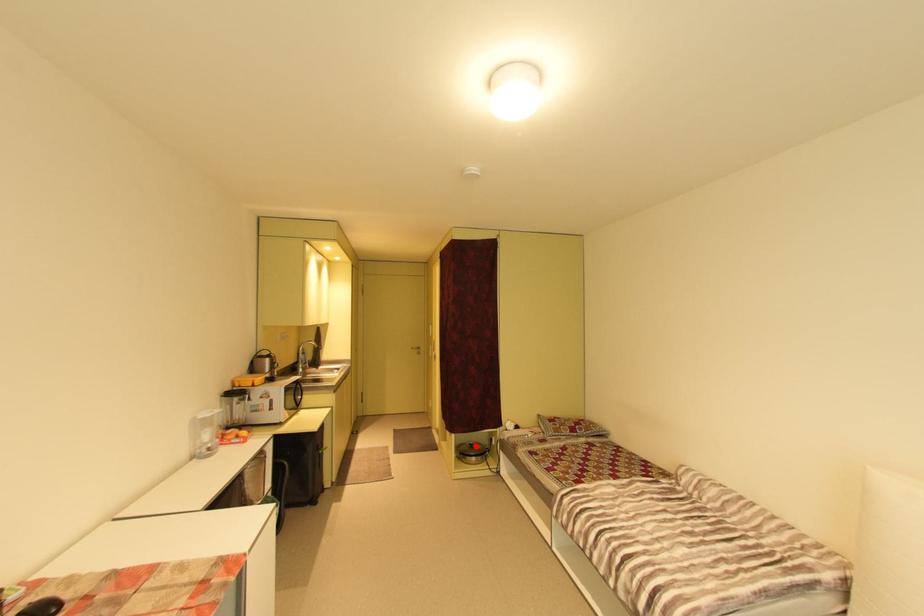
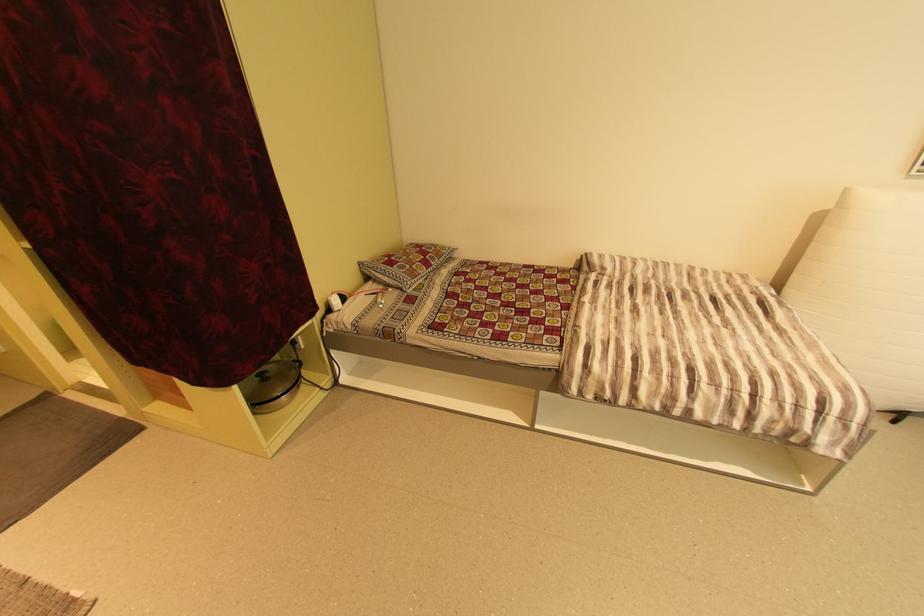
Question: I am providing you with two images of the same scene from different viewpoints. Image1 has a red point marked. In image2, the corresponding 3D location appears at what relative position? Reply with the corresponding letter.

Choices:
 (A) Closer
 (B) Farther

Answer: (A)